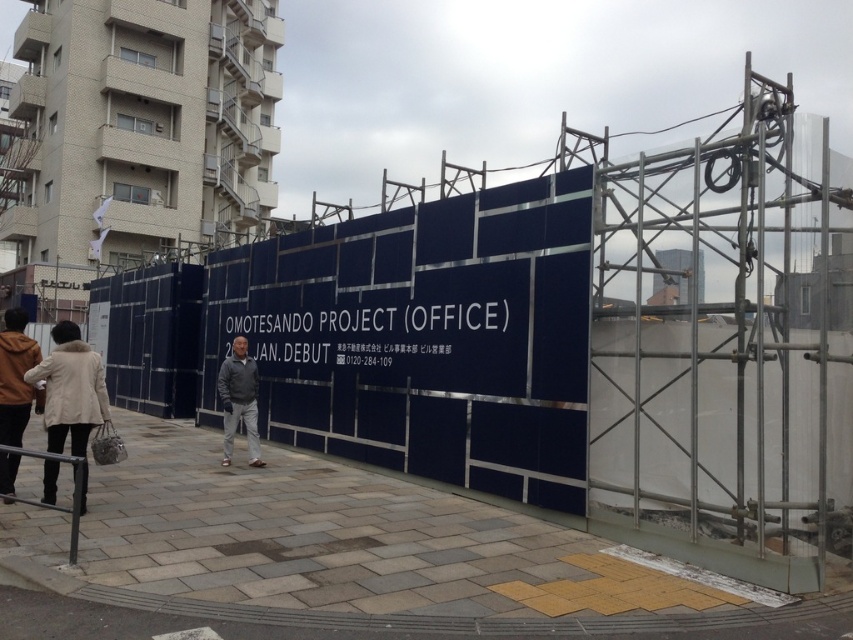
You are a delivery person approaching the Omotesando Project construction site. You see a beige wool coat at lower left and a dark gray jacket at center. Which clothing item is nearer to you as you arrive?

The beige wool coat at lower left is closer to the viewer than the dark gray jacket at center, so the beige wool coat at lower left is nearer to you as you arrive.

You are a fashion designer observing the Omotesando Project construction site. You notice a beige wool coat at lower left and a dark gray jacket at center. Which clothing item appears narrower when viewed from your perspective?

The beige wool coat at lower left has a lesser width compared to the dark gray jacket at center, so the beige wool coat at lower left appears narrower.